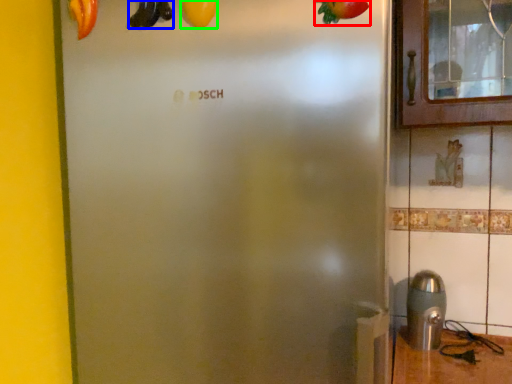
Question: Based on their relative distances, which object is farther from fruit (highlighted by a red box)? Choose from banana (highlighted by a blue box) and fruit (highlighted by a green box).

Choices:
 (A) banana
 (B) fruit

Answer: (A)